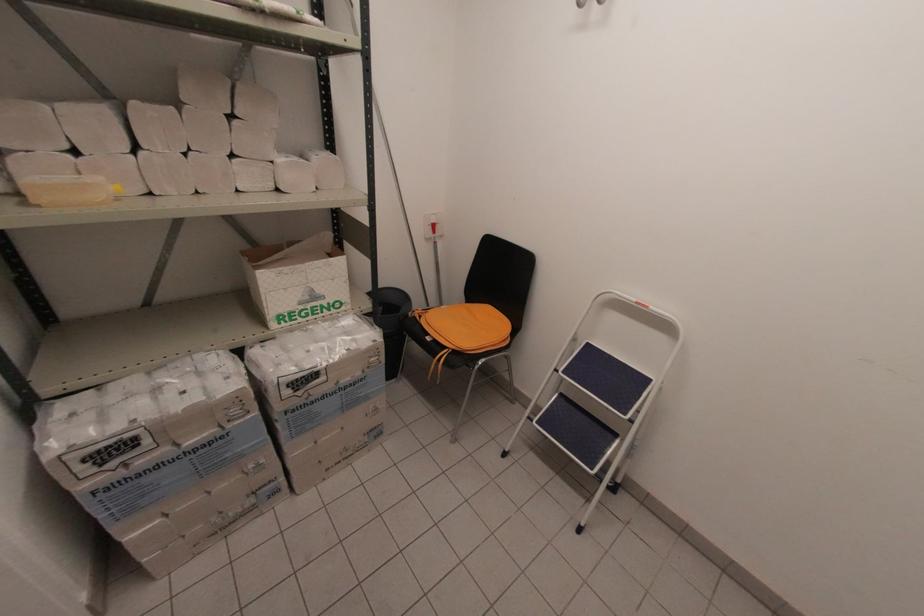
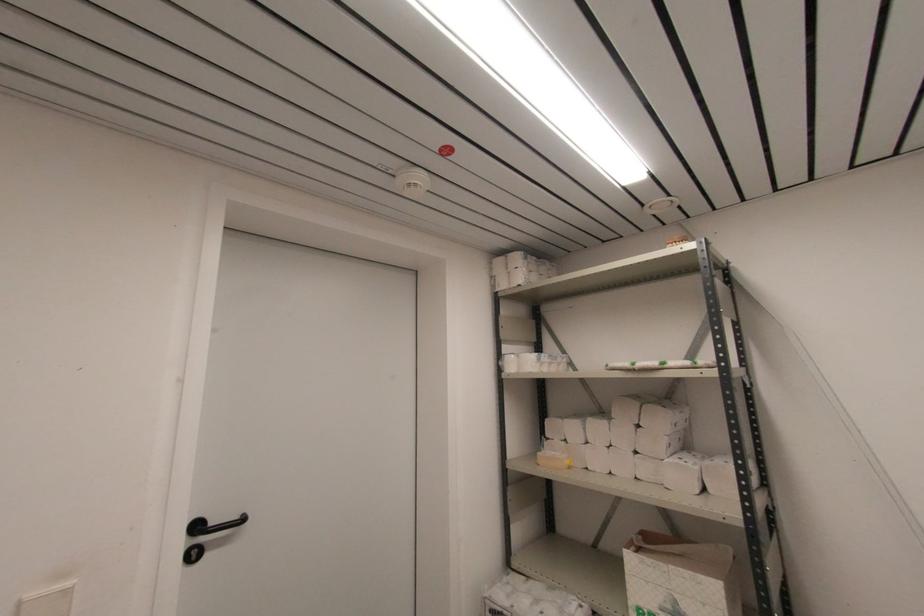
Where in the second image is the point corresponding to point 309,298 from the first image?

(671, 609)